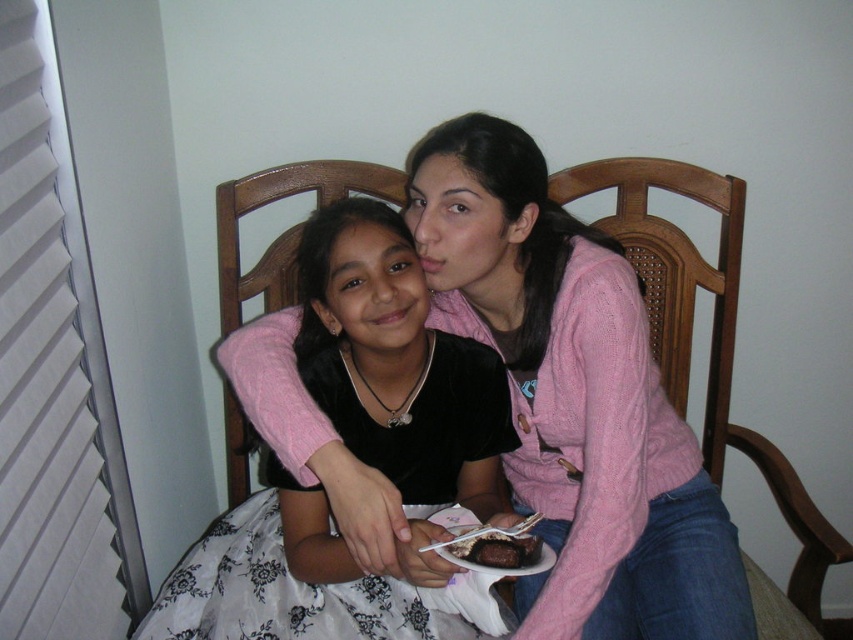
Question: Is black velvet dress at center wider than wooden chair at center?

Choices:
 (A) no
 (B) yes

Answer: (B)

Question: Is wooden chair at center below chocolate cake at center?

Choices:
 (A) no
 (B) yes

Answer: (A)

Question: Considering the relative positions of black velvet dress at center and chocolate cake at center in the image provided, where is black velvet dress at center located with respect to chocolate cake at center?

Choices:
 (A) right
 (B) left

Answer: (B)

Question: Which object is farther from the camera taking this photo?

Choices:
 (A) chocolate cake at center
 (B) black velvet dress at center
 (C) wooden chair at center

Answer: (C)

Question: Which of the following is the closest to the observer?

Choices:
 (A) (352, 577)
 (B) (624, 205)
 (C) (451, 545)

Answer: (C)

Question: Which of the following is the farthest from the observer?

Choices:
 (A) chocolate cake at center
 (B) black velvet dress at center

Answer: (B)